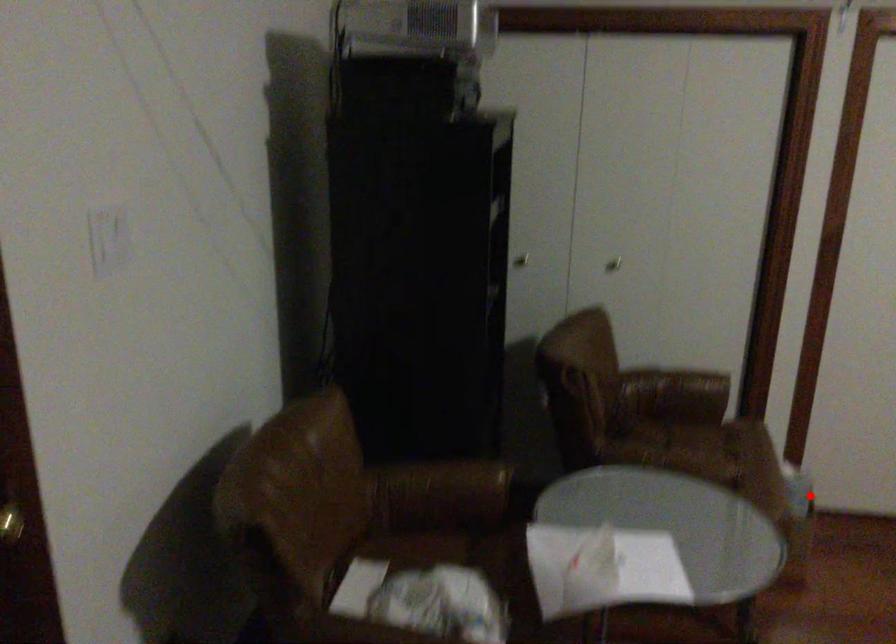
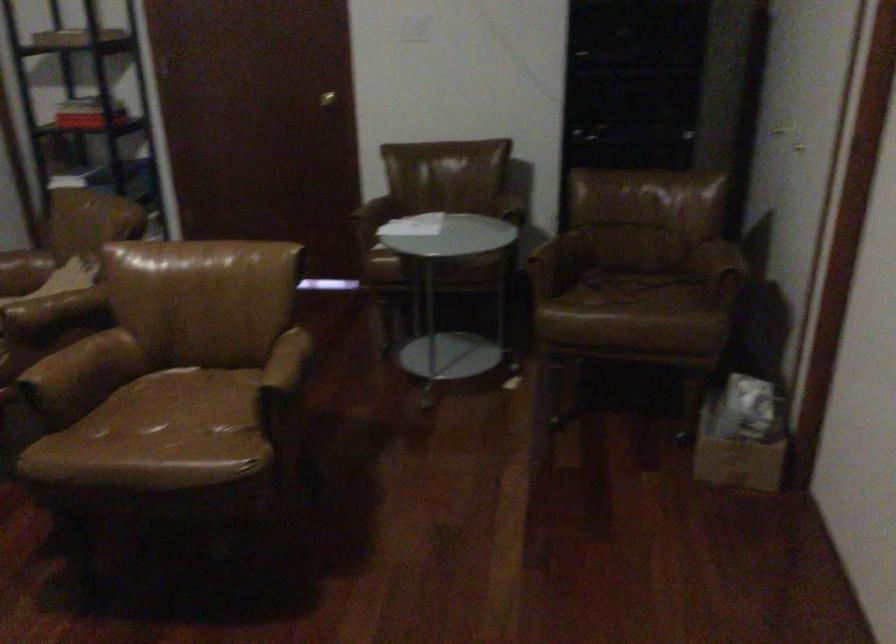
Find the pixel in the second image that matches the highlighted location in the first image.

(742, 436)